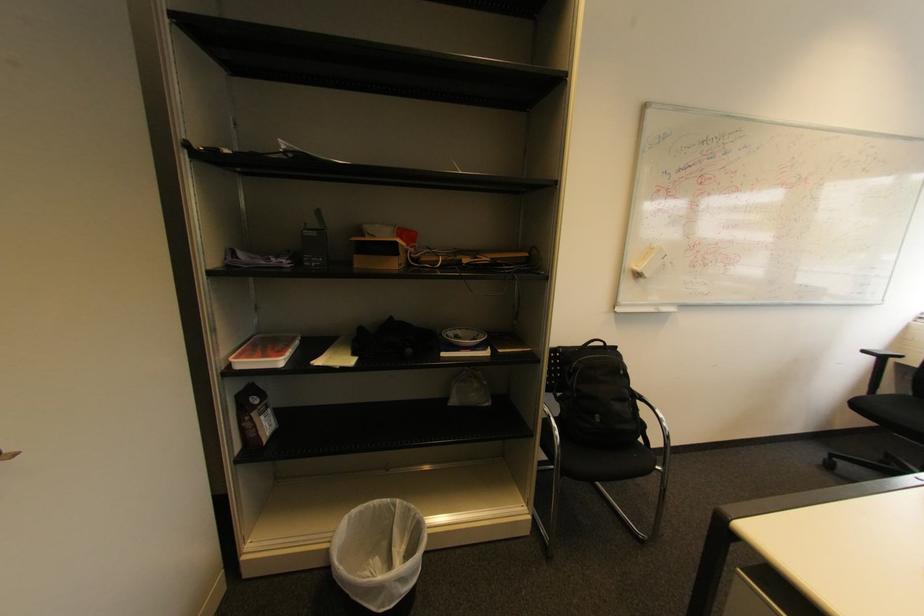
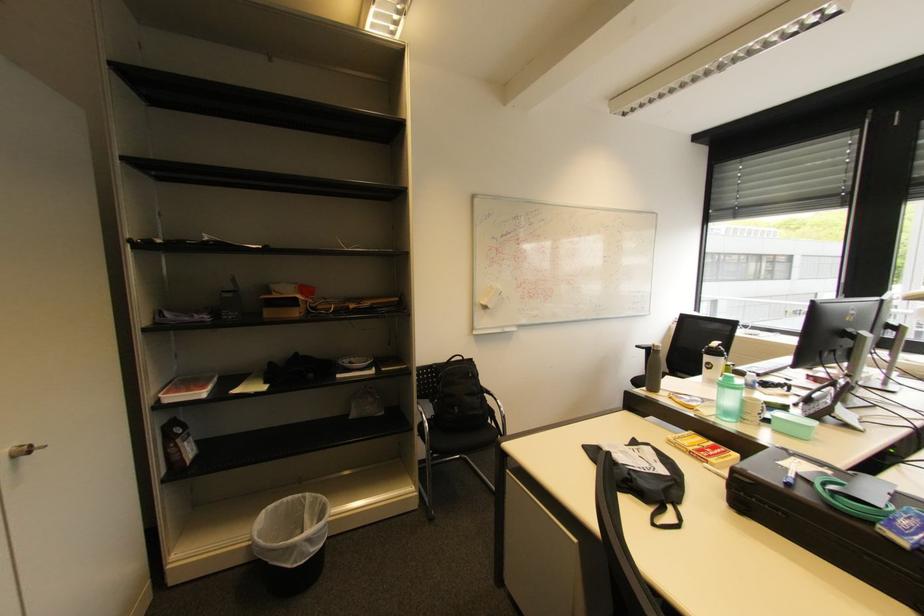
Question: The camera is either moving clockwise (left) or counter-clockwise (right) around the object. The first image is from the beginning of the video and the second image is from the end. Is the camera moving left or right when shooting the video?

Choices:
 (A) Left
 (B) Right

Answer: (A)